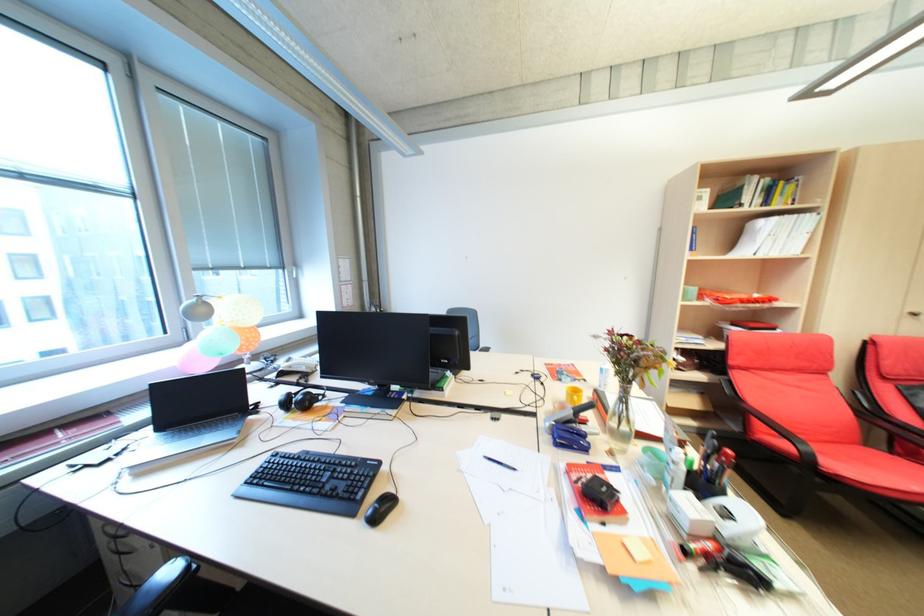
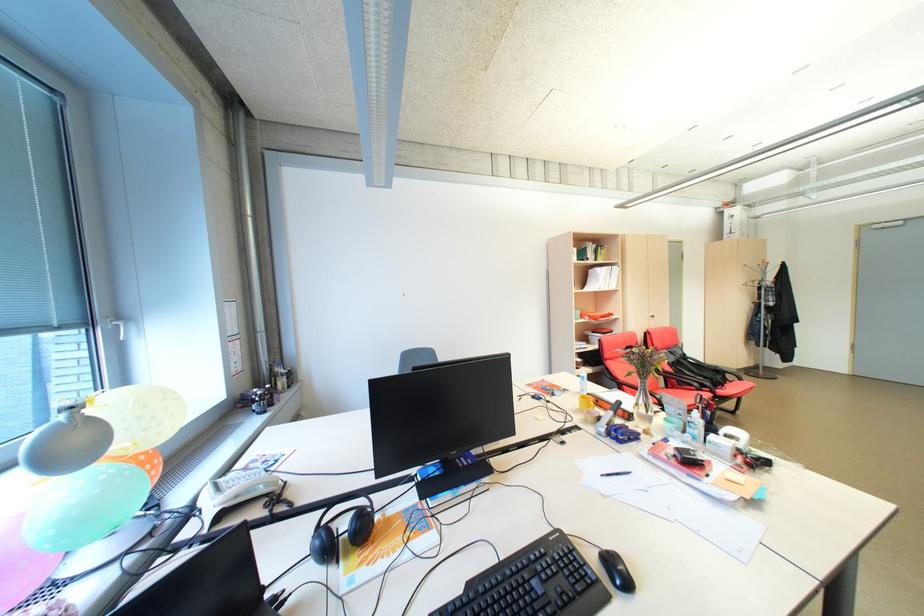
The point at (879, 344) is marked in the first image. Where is the corresponding point in the second image?

(655, 334)